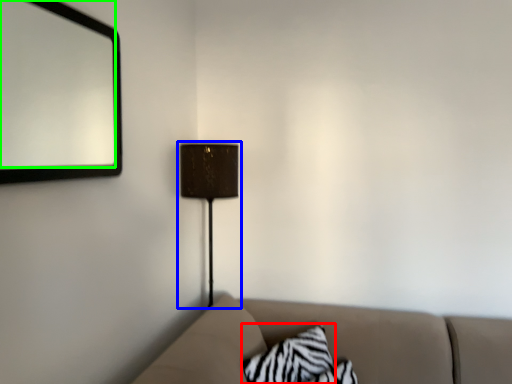
Question: Considering the real-world distances, which object is farthest from pillow (highlighted by a red box)? lamp (highlighted by a blue box) or mirror (highlighted by a green box)?

Choices:
 (A) lamp
 (B) mirror

Answer: (B)